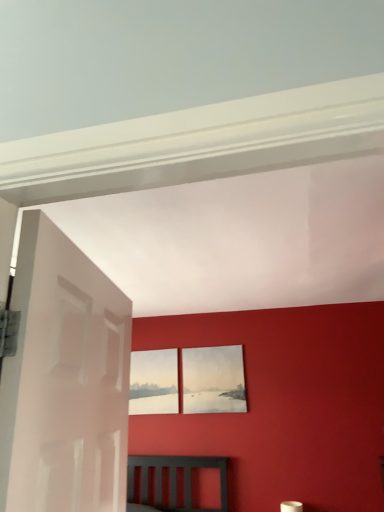
Question: Would you say matte paper picture frame at center, the 1th picture frame viewed from the right, is outside white glossy door at left?

Choices:
 (A) no
 (B) yes

Answer: (B)

Question: Is matte paper picture frame at center, which appears as the 2th picture frame when viewed from the left, positioned in front of white glossy door at left?

Choices:
 (A) yes
 (B) no

Answer: (B)

Question: From the image's perspective, is matte paper picture frame at center, the 1th picture frame viewed from the right, below white glossy door at left?

Choices:
 (A) yes
 (B) no

Answer: (A)

Question: Considering the relative sizes of matte paper picture frame at center, the 1th picture frame viewed from the right, and white glossy door at left in the image provided, is matte paper picture frame at center, the 1th picture frame viewed from the right, thinner than white glossy door at left?

Choices:
 (A) no
 (B) yes

Answer: (B)

Question: Is white glossy door at left surrounded by matte paper picture frame at center, which appears as the 2th picture frame when viewed from the left?

Choices:
 (A) no
 (B) yes

Answer: (A)

Question: Would you consider matte paper picture frame at center, which appears as the 2th picture frame when viewed from the left, to be distant from white glossy door at left?

Choices:
 (A) yes
 (B) no

Answer: (A)

Question: From a real-world perspective, is matte white picture frame at center, the 2th picture frame from the right, on matte paper picture frame at center, which appears as the 2th picture frame when viewed from the left?

Choices:
 (A) yes
 (B) no

Answer: (A)

Question: Is matte paper picture frame at center, which appears as the 2th picture frame when viewed from the left, located within matte white picture frame at center, the 2th picture frame from the right?

Choices:
 (A) yes
 (B) no

Answer: (B)

Question: Considering the relative sizes of matte white picture frame at center, the 2th picture frame from the right, and matte paper picture frame at center, which appears as the 2th picture frame when viewed from the left, in the image provided, is matte white picture frame at center, the 2th picture frame from the right, shorter than matte paper picture frame at center, which appears as the 2th picture frame when viewed from the left,?

Choices:
 (A) no
 (B) yes

Answer: (B)

Question: Does matte white picture frame at center, marked as the 1th picture frame in a left-to-right arrangement, have a larger size compared to matte paper picture frame at center, the 1th picture frame viewed from the right?

Choices:
 (A) no
 (B) yes

Answer: (A)

Question: Is matte white picture frame at center, marked as the 1th picture frame in a left-to-right arrangement, wider than matte paper picture frame at center, which appears as the 2th picture frame when viewed from the left?

Choices:
 (A) no
 (B) yes

Answer: (B)

Question: Is matte white picture frame at center, the 2th picture frame from the right, completely or partially outside of matte paper picture frame at center, the 1th picture frame viewed from the right?

Choices:
 (A) yes
 (B) no

Answer: (A)

Question: Is the surface of white glossy door at left in direct contact with matte white picture frame at center, marked as the 1th picture frame in a left-to-right arrangement?

Choices:
 (A) no
 (B) yes

Answer: (A)